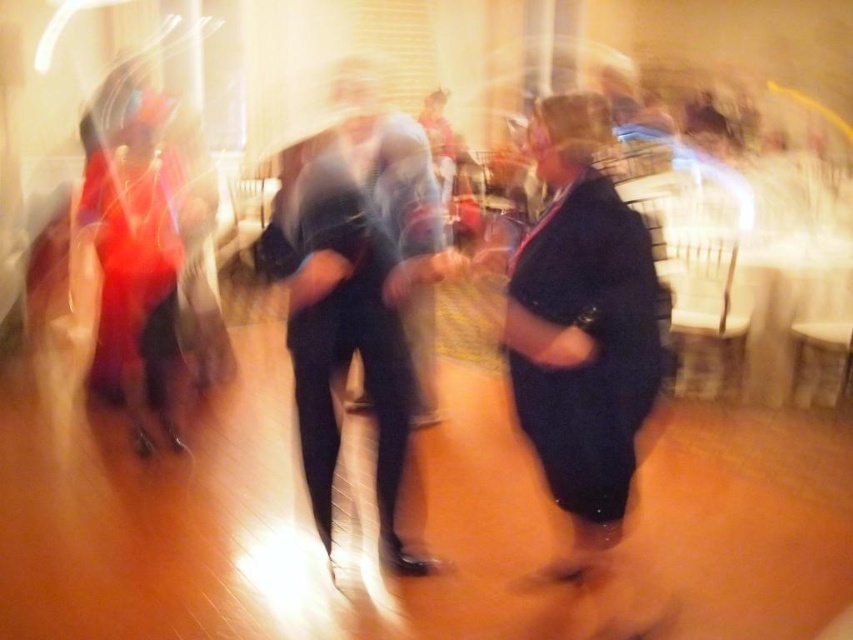
Question: Can you confirm if matte black suit at center is positioned below dark blue jeans at center?

Choices:
 (A) yes
 (B) no

Answer: (B)

Question: In this image, where is matte black suit at center located relative to dark blue jeans at center?

Choices:
 (A) below
 (B) above

Answer: (B)

Question: Which point appears closest to the camera in this image?

Choices:
 (A) (x=509, y=292)
 (B) (x=291, y=337)

Answer: (A)

Question: Is matte black suit at center thinner than dark blue jeans at center?

Choices:
 (A) yes
 (B) no

Answer: (B)